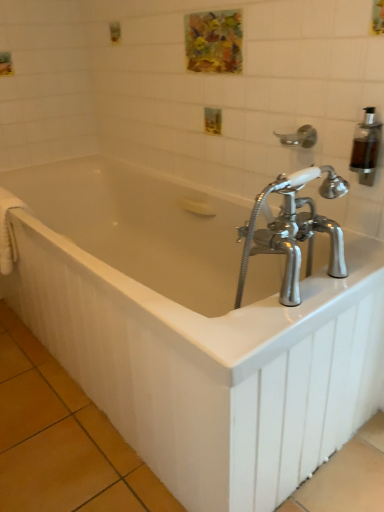
Question: From a real-world perspective, is silver metallic shower head at upper right positioned above or below watercolor painting at upper center?

Choices:
 (A) above
 (B) below

Answer: (B)

Question: Considering the positions of silver metallic shower head at upper right and watercolor painting at upper center in the image, is silver metallic shower head at upper right taller or shorter than watercolor painting at upper center?

Choices:
 (A) tall
 (B) short

Answer: (B)

Question: Which is farther from the white glossy bathtub at center?

Choices:
 (A) transparent plastic soap dispenser at upper right
 (B) white fabric towel bar at left
 (C) silver metallic shower head at upper right
 (D) watercolor painting at upper center

Answer: (D)

Question: Which of these objects is positioned closest to the white glossy bathtub at center?

Choices:
 (A) white fabric towel bar at left
 (B) watercolor painting at upper center
 (C) silver metallic shower head at upper right
 (D) transparent plastic soap dispenser at upper right

Answer: (A)